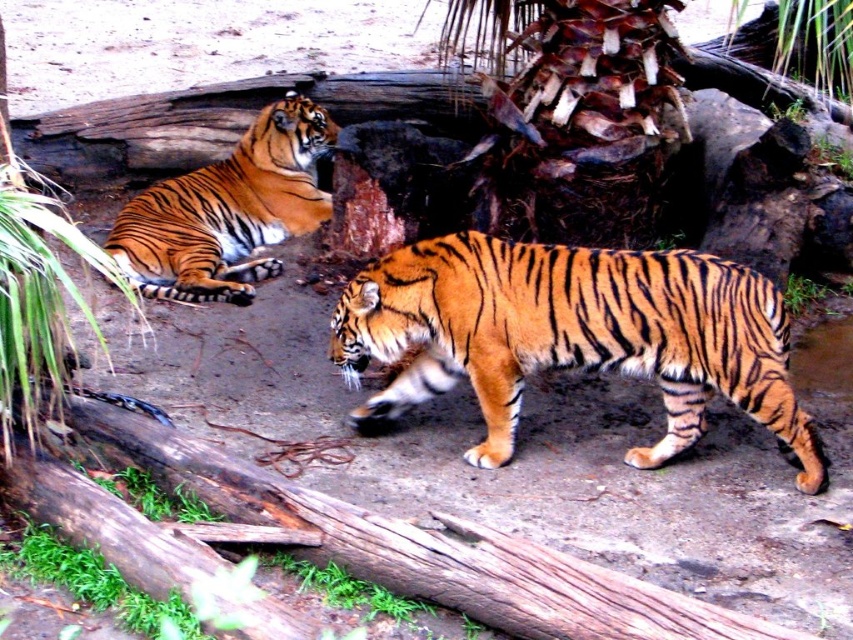
Question: Which point is farther to the camera?

Choices:
 (A) (773, 300)
 (B) (260, 122)

Answer: (B)

Question: Is orange striped tiger at center below orange striped tiger at upper left?

Choices:
 (A) no
 (B) yes

Answer: (B)

Question: From the image, what is the correct spatial relationship of orange striped tiger at center in relation to orange striped tiger at upper left?

Choices:
 (A) above
 (B) below

Answer: (B)

Question: Is orange striped tiger at center bigger than orange striped tiger at upper left?

Choices:
 (A) no
 (B) yes

Answer: (B)